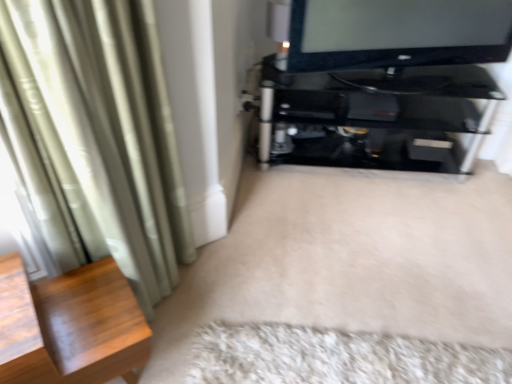
Question: Would you say wooden side table at left contains white fluffy rug at lower center?

Choices:
 (A) yes
 (B) no

Answer: (B)

Question: Is wooden side table at left shorter than white fluffy rug at lower center?

Choices:
 (A) yes
 (B) no

Answer: (B)

Question: Is wooden side table at left looking in the opposite direction of white fluffy rug at lower center?

Choices:
 (A) yes
 (B) no

Answer: (B)

Question: Is the depth of wooden side table at left greater than that of white fluffy rug at lower center?

Choices:
 (A) yes
 (B) no

Answer: (B)

Question: Does wooden side table at left have a greater width compared to white fluffy rug at lower center?

Choices:
 (A) no
 (B) yes

Answer: (B)

Question: Is wooden side table at left facing towards white fluffy rug at lower center?

Choices:
 (A) no
 (B) yes

Answer: (A)

Question: Does white fluffy rug at lower center touch black glass shelf at upper right?

Choices:
 (A) yes
 (B) no

Answer: (B)

Question: Is white fluffy rug at lower center smaller than black glass shelf at upper right?

Choices:
 (A) yes
 (B) no

Answer: (A)

Question: Is white fluffy rug at lower center shorter than black glass shelf at upper right?

Choices:
 (A) yes
 (B) no

Answer: (A)

Question: Is black glass shelf at upper right inside white fluffy rug at lower center?

Choices:
 (A) yes
 (B) no

Answer: (B)

Question: From a real-world perspective, is white fluffy rug at lower center located beneath black glass shelf at upper right?

Choices:
 (A) yes
 (B) no

Answer: (A)

Question: Does white fluffy rug at lower center appear on the right side of black glass shelf at upper right?

Choices:
 (A) yes
 (B) no

Answer: (B)

Question: From a real-world perspective, is black glossy television at upper right located beneath white fluffy rug at lower center?

Choices:
 (A) yes
 (B) no

Answer: (B)